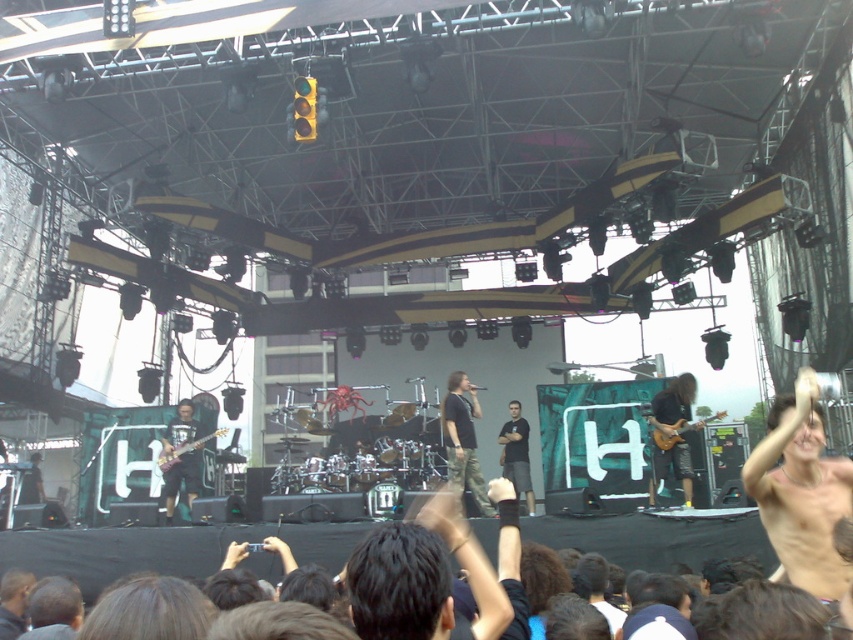
Question: Is camouflage pants at center to the left of black cotton shirt at center from the viewer's perspective?

Choices:
 (A) no
 (B) yes

Answer: (B)

Question: Which point appears closest to the camera in this image?

Choices:
 (A) (519, 480)
 (B) (190, 401)

Answer: (A)

Question: Which object appears farthest from the camera in this image?

Choices:
 (A) black cotton shirt at center
 (B) shiny black guitar at center
 (C) camouflage pants at center

Answer: (B)

Question: Which object appears closest to the camera in this image?

Choices:
 (A) shiny black guitar at center
 (B) black cotton shirt at center

Answer: (B)

Question: Is camouflage pants at center wider than shiny black guitar at center?

Choices:
 (A) yes
 (B) no

Answer: (B)

Question: Considering the relative positions of camouflage pants at center and shiny black guitar at center in the image provided, where is camouflage pants at center located with respect to shiny black guitar at center?

Choices:
 (A) above
 (B) below

Answer: (A)